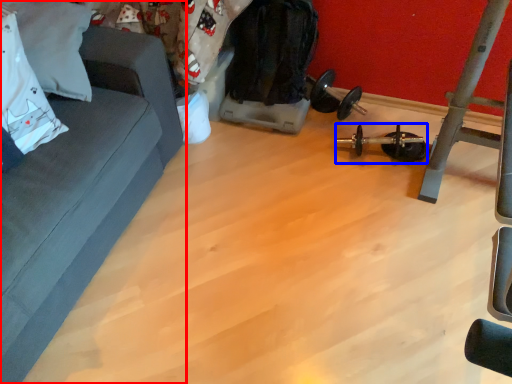
Question: Which point is closer to the camera, studio couch (highlighted by a red box) or equipment (highlighted by a blue box)?

Choices:
 (A) studio couch
 (B) equipment

Answer: (A)